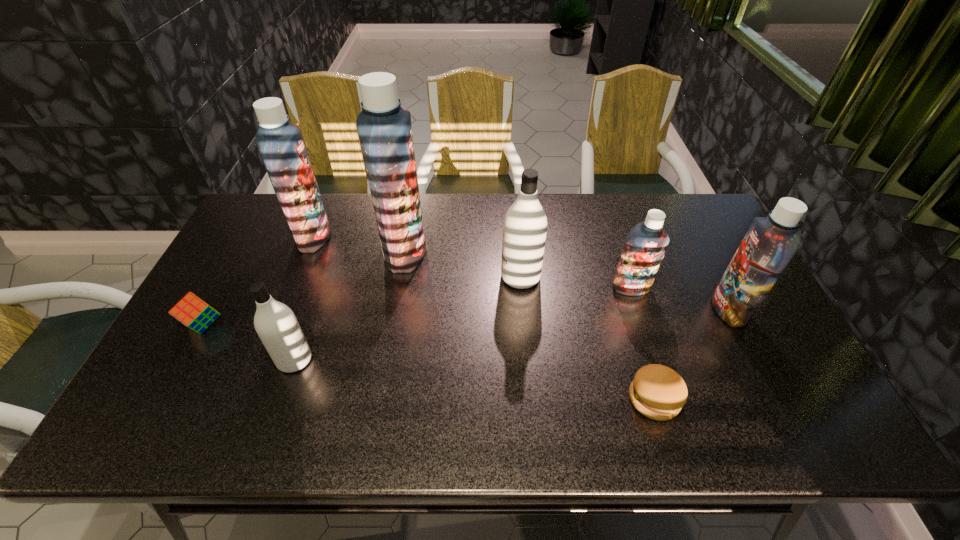
At what (x,y) coordinates should I click in order to perform the action: click on the smallest blue shampoo. Please return your answer as a coordinate pair (x, y). Image resolution: width=960 pixels, height=540 pixels. Looking at the image, I should click on (644, 248).

The width and height of the screenshot is (960, 540). Find the location of `the third blue shampoo from left to right`. the third blue shampoo from left to right is located at coordinates (644, 248).

This screenshot has height=540, width=960. I want to click on the leftmost object, so click(193, 312).

What are the coordinates of `red cube` in the screenshot? It's located at (193, 312).

The width and height of the screenshot is (960, 540). What are the coordinates of `the shortest object` in the screenshot? It's located at (658, 392).

What are the coordinates of `the nearest object` in the screenshot? It's located at (658, 392).

Where is `vacant position located 0.360m on the front label of the tallest shampoo`? This screenshot has width=960, height=540. vacant position located 0.360m on the front label of the tallest shampoo is located at coordinates (540, 252).

You are a GUI agent. You are given a task and a screenshot of the screen. Output one action in this format:
    pyautogui.click(x=<x>, y=<y>)
    Task: Click on the vacant region located 0.370m on the front label of the second tallest shampoo
    
    Given the screenshot: What is the action you would take?
    pyautogui.click(x=444, y=237)

The width and height of the screenshot is (960, 540). Find the location of `free space located on the front label of the rightmost object`. free space located on the front label of the rightmost object is located at coordinates (588, 309).

The image size is (960, 540). I want to click on blank space located on the front label of the rightmost object, so click(x=616, y=309).